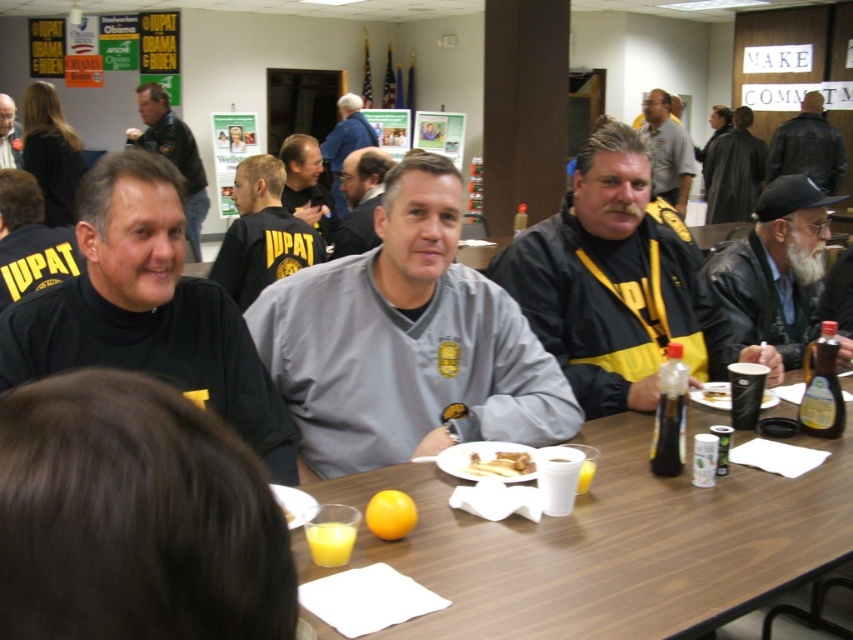
Who is higher up, black leather jacket at right or yellow lanyard at center?

Positioned higher is yellow lanyard at center.

Does black leather jacket at right appear on the left side of yellow lanyard at center?

Indeed, black leather jacket at right is positioned on the left side of yellow lanyard at center.

Does point (822, 234) come in front of point (660, 141)?

Yes, point (822, 234) is in front of point (660, 141).

The height and width of the screenshot is (640, 853). I want to click on black leather jacket at right, so click(775, 268).

Which is more to the left, translucent glass cup at table center or matte black turtleneck at upper left?

matte black turtleneck at upper left is more to the left.

Which is above, translucent glass cup at table center or matte black turtleneck at upper left?

matte black turtleneck at upper left is higher up.

Locate an element on the screen. This screenshot has height=640, width=853. translucent glass cup at table center is located at coordinates (329, 540).

Can you confirm if black turtleneck sweater at center is positioned below golden brown hash browns at table center?

Incorrect, black turtleneck sweater at center is not positioned below golden brown hash browns at table center.

At what (x,y) coordinates should I click in order to perform the action: click on black turtleneck sweater at center. Please return your answer as a coordinate pair (x, y). The image size is (853, 640). Looking at the image, I should click on (148, 308).

Identify the location of black turtleneck sweater at center. The width and height of the screenshot is (853, 640). (148, 308).